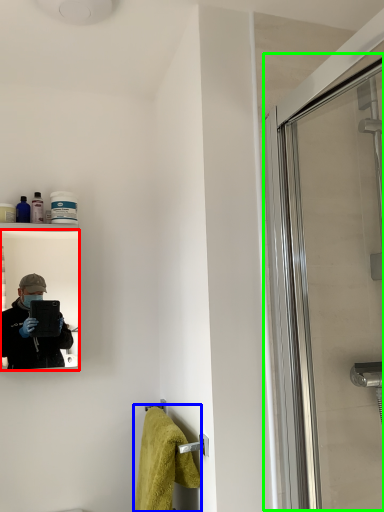
Question: Which is nearer to the mirror (highlighted by a red box)? bath towel (highlighted by a blue box) or screen door (highlighted by a green box).

Choices:
 (A) bath towel
 (B) screen door

Answer: (A)